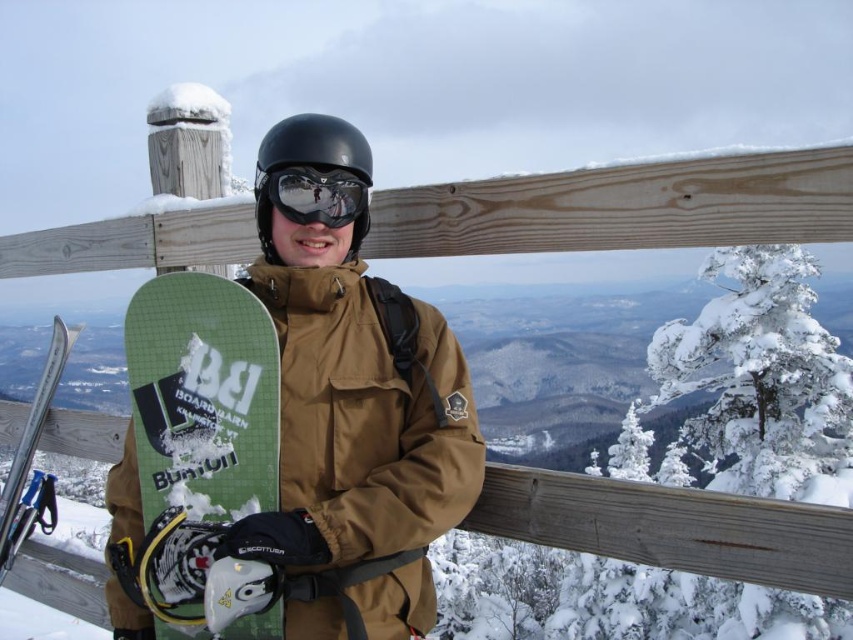
Who is lower down, matte brown snowboard at center or green matte snowboard at lower left?

green matte snowboard at lower left is lower down.

Find the location of `matte brown snowboard at center`. matte brown snowboard at center is located at coordinates (360, 403).

The height and width of the screenshot is (640, 853). Describe the element at coordinates (360, 403) in the screenshot. I see `matte brown snowboard at center` at that location.

Find the location of a particular element. matte brown snowboard at center is located at coordinates (360, 403).

Can you confirm if matte brown snowboard at center is positioned above black matte helmet at center?

Incorrect, matte brown snowboard at center is not positioned above black matte helmet at center.

What do you see at coordinates (360, 403) in the screenshot? I see `matte brown snowboard at center` at bounding box center [360, 403].

The height and width of the screenshot is (640, 853). I want to click on matte brown snowboard at center, so click(360, 403).

This screenshot has width=853, height=640. What do you see at coordinates (202, 396) in the screenshot? I see `green matte snowboard at lower left` at bounding box center [202, 396].

Who is more distant from viewer, (175, 429) or (368, 227)?

The point (368, 227) is behind.

Image resolution: width=853 pixels, height=640 pixels. What do you see at coordinates (202, 396) in the screenshot?
I see `green matte snowboard at lower left` at bounding box center [202, 396].

Locate an element on the screen. The height and width of the screenshot is (640, 853). green matte snowboard at lower left is located at coordinates (202, 396).